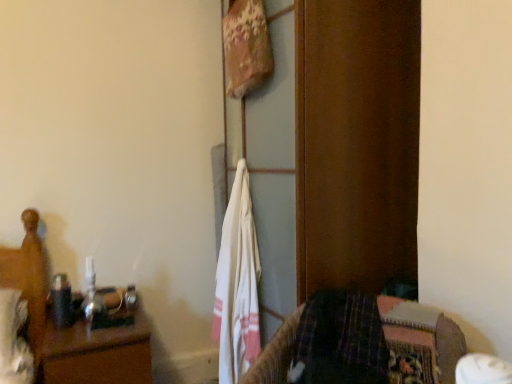
Question: Considering the positions of point (251, 231) and point (419, 317), is point (251, 231) closer or farther from the camera than point (419, 317)?

Choices:
 (A) farther
 (B) closer

Answer: (A)

Question: Considering their positions, is white cotton towel at center located in front of or behind plaid fabric bedspread at lower right?

Choices:
 (A) behind
 (B) front

Answer: (A)

Question: Which object is positioned closest to the white cotton towel at center?

Choices:
 (A) wooden nightstand at left
 (B) plaid fabric bedspread at lower right
 (C) wooden bed at left

Answer: (A)

Question: Estimate the real-world distances between objects in this image. Which object is farther from the white cotton towel at center?

Choices:
 (A) plaid fabric bedspread at lower right
 (B) wooden nightstand at left
 (C) wooden bed at left

Answer: (C)